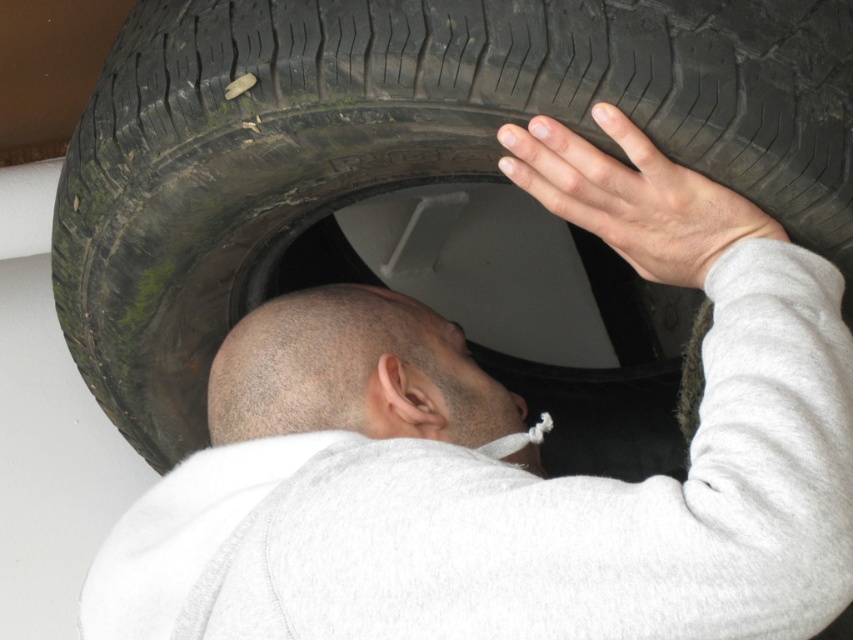
You are a technician trying to locate two points on a vehicle in the image. The first point is at coordinates point (404,396) and the second is at point (634,268). Which point is closer to the camera?

Point (404,396) is further to the camera than point (634,268), so the second point is closer to the camera.

You are standing in front of the scene and want to reach both points. Which point, point (664,124) or point (579,179), will you reach first?

Point (664,124) is closer to the viewer than point (579,179), so you will reach point (664,124) first.

You are a mechanic working in a garage. You need to place a tool box that is 0.3 meters wide on the garage floor. The tool box must be placed at least 0.1 meters away from the black rubber tire at upper center. Where can you place the tool box on the garage floor?

The black rubber tire at upper center is located at coordinates point (395, 148). To place the tool box 0.1 meters away from it, you can position the tool box anywhere on the garage floor except within a 0.1 meter radius around the tire. Ensure the tool box is placed at least 0.1 meters away from the tire to comply with safety regulations.